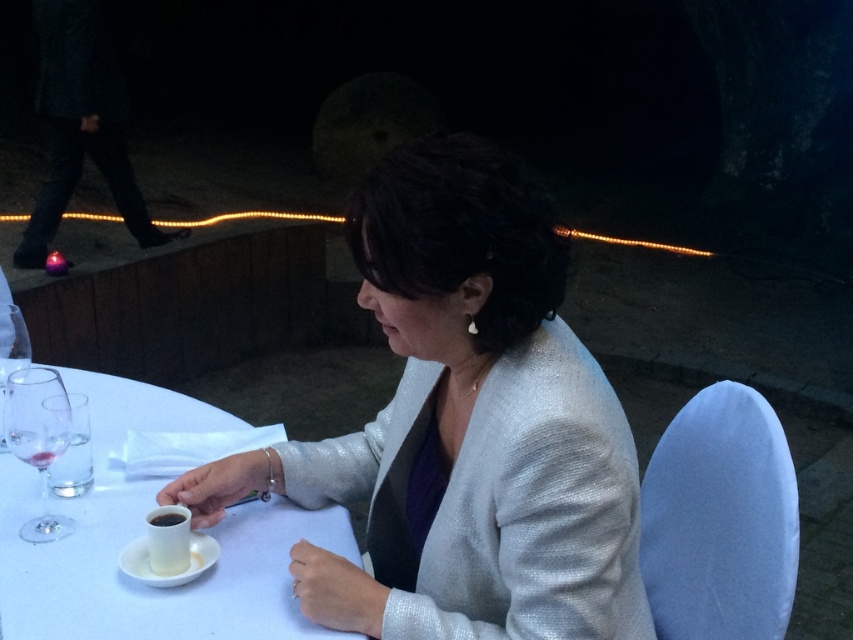
Question: Does white ceramic saucer at lower center have a greater width compared to black glossy cup at lower left?

Choices:
 (A) yes
 (B) no

Answer: (A)

Question: In this image, where is clear glass wine glass at lower left located relative to transparent glass at left?

Choices:
 (A) right
 (B) left

Answer: (A)

Question: Considering the relative positions of white ceramic saucer at lower center and transparent glass at left in the image provided, where is white ceramic saucer at lower center located with respect to transparent glass at left?

Choices:
 (A) right
 (B) left

Answer: (A)

Question: Among these points, which one is nearest to the camera?

Choices:
 (A) (281, 593)
 (B) (173, 516)
 (C) (556, 504)

Answer: (C)

Question: Which object appears closest to the camera in this image?

Choices:
 (A) clear glass wine glass at lower left
 (B) shiny silver jacket at center

Answer: (B)

Question: Which point is closer to the camera taking this photo?

Choices:
 (A) (200, 540)
 (B) (154, 524)
 (C) (22, 396)

Answer: (B)